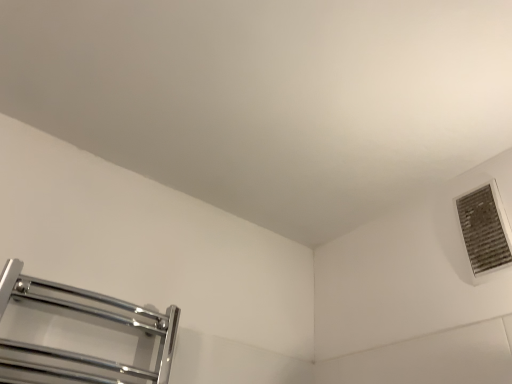
This screenshot has width=512, height=384. What do you see at coordinates (484, 229) in the screenshot? I see `white plastic air conditioning at upper right` at bounding box center [484, 229].

The height and width of the screenshot is (384, 512). I want to click on white plastic air conditioning at upper right, so click(x=484, y=229).

The height and width of the screenshot is (384, 512). Identify the location of white plastic air conditioning at upper right. (484, 229).